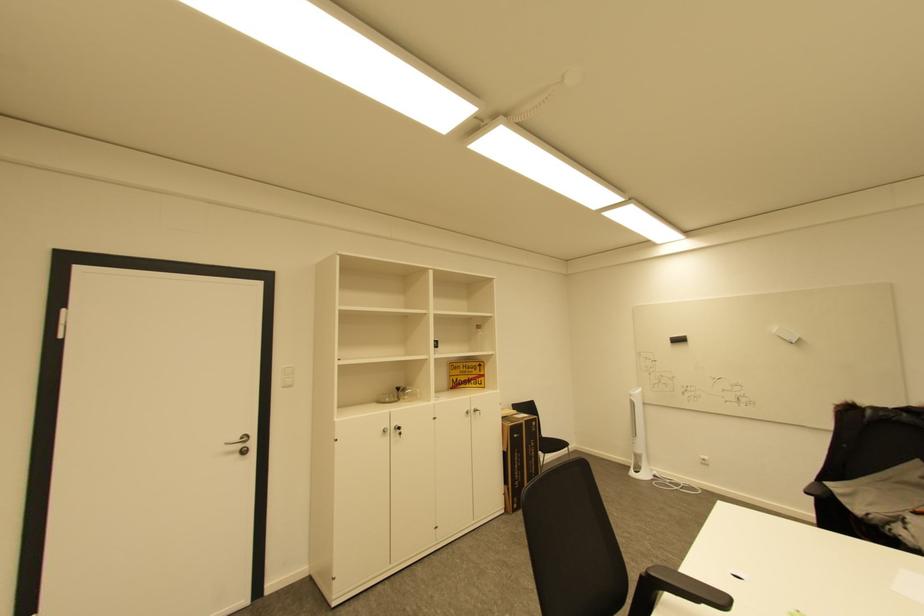
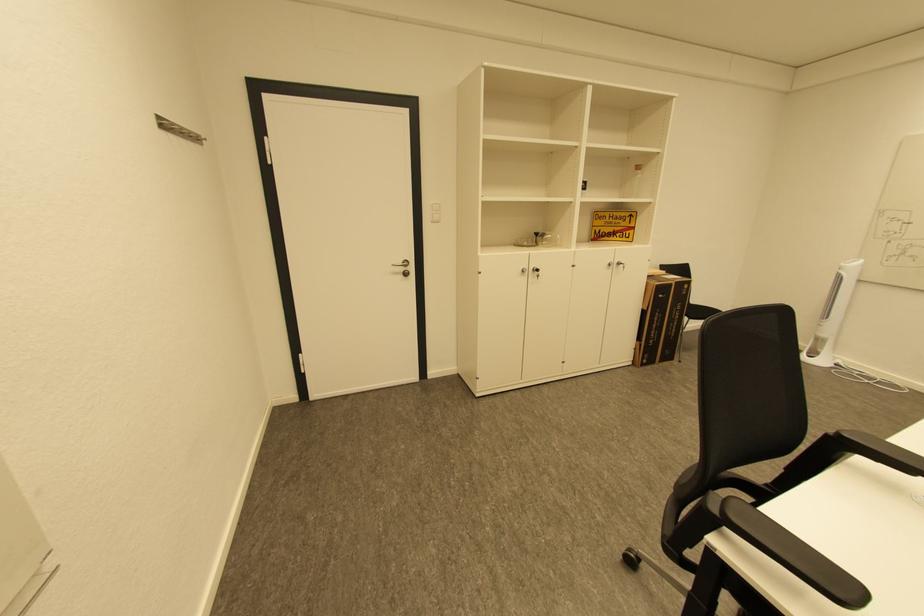
Find the pixel in the second image that matches [405,390] in the first image.

(543, 235)